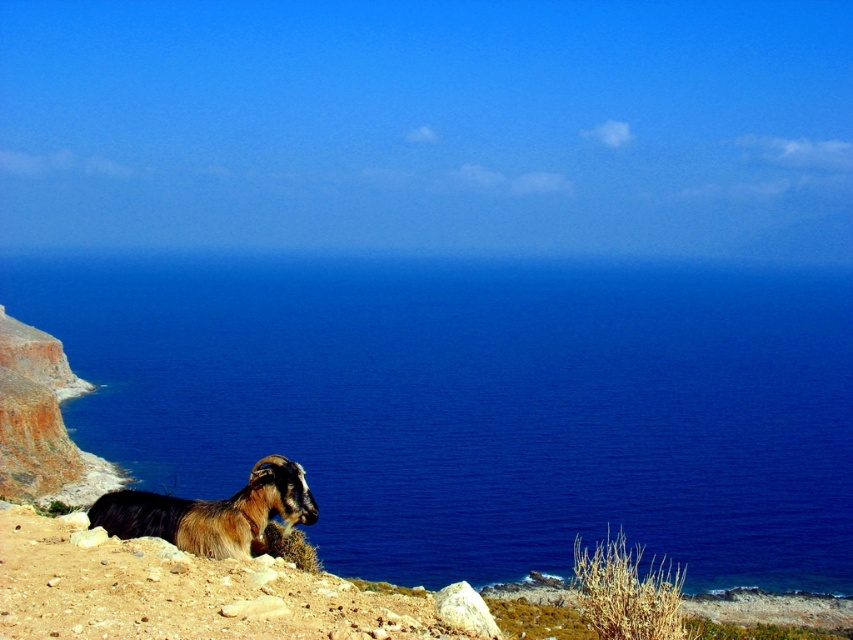
You are a hiker who wants to cross the rocky shoreline to reach the blue water at lower left. The brown woolen ram at lower left is blocking your path. Can you go around the ram to the left side to reach the water?

The blue water at lower left is positioned on the right side of brown woolen ram at lower left, so you can go around the ram to the left side to reach the blue water at lower left.

You are standing at the point labeled as point (479, 404) in the coastal scene. Looking towards the direction of the goat lying on the rocky terrain, what color is the area you are facing?

The area you are facing is blue water at lower left, as the point (479, 404) marks blue water at lower left.